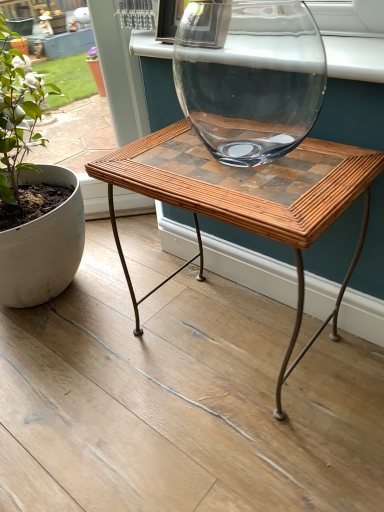
At what (x,y) coordinates should I click in order to perform the action: click on free space above woven wood table at center (from a real-world perspective). Please return your answer as a coordinate pair (x, y). The width and height of the screenshot is (384, 512). Looking at the image, I should click on point(238,155).